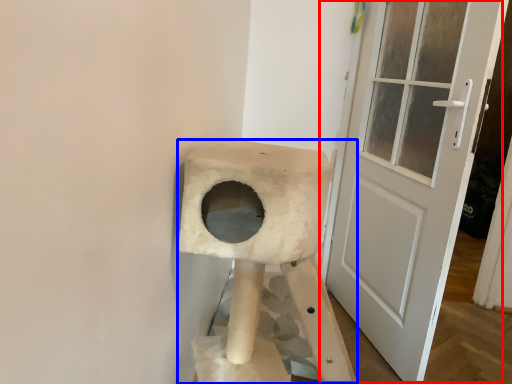
Question: Which of the following is the closest to the observer, door (highlighted by a red box) or cat furniture (highlighted by a blue box)?

Choices:
 (A) door
 (B) cat furniture

Answer: (B)